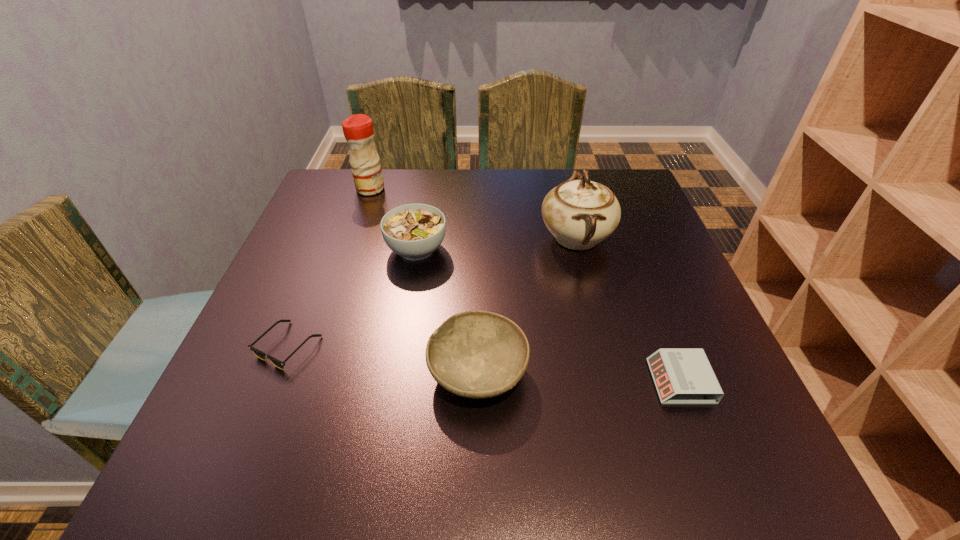
Where is `the farthest object`? Image resolution: width=960 pixels, height=540 pixels. the farthest object is located at coordinates (358, 130).

The height and width of the screenshot is (540, 960). What are the coordinates of `chinaware` in the screenshot? It's located at (581, 213).

This screenshot has width=960, height=540. I want to click on soup bowl, so click(x=414, y=231).

At what (x,y) coordinates should I click in order to perform the action: click on bowl. Please return your answer as a coordinate pair (x, y). This screenshot has width=960, height=540. Looking at the image, I should click on (476, 354).

Locate an element on the screen. the second shortest object is located at coordinates (682, 376).

At what (x,y) coordinates should I click in order to perform the action: click on sunglasses. Please return your answer as a coordinate pair (x, y). Looking at the image, I should click on (258, 353).

This screenshot has height=540, width=960. What are the coordinates of `free space located on the front of the farthest object` in the screenshot? It's located at (345, 264).

Locate an element on the screen. free space located on the front of the chinaware is located at coordinates (598, 324).

Locate an element on the screen. The image size is (960, 540). vacant point located on the front of the fourth shortest object is located at coordinates (396, 380).

At what (x,y) coordinates should I click in order to perform the action: click on vacant space located 0.200m on the left of the bowl. Please return your answer as a coordinate pair (x, y). Looking at the image, I should click on (318, 372).